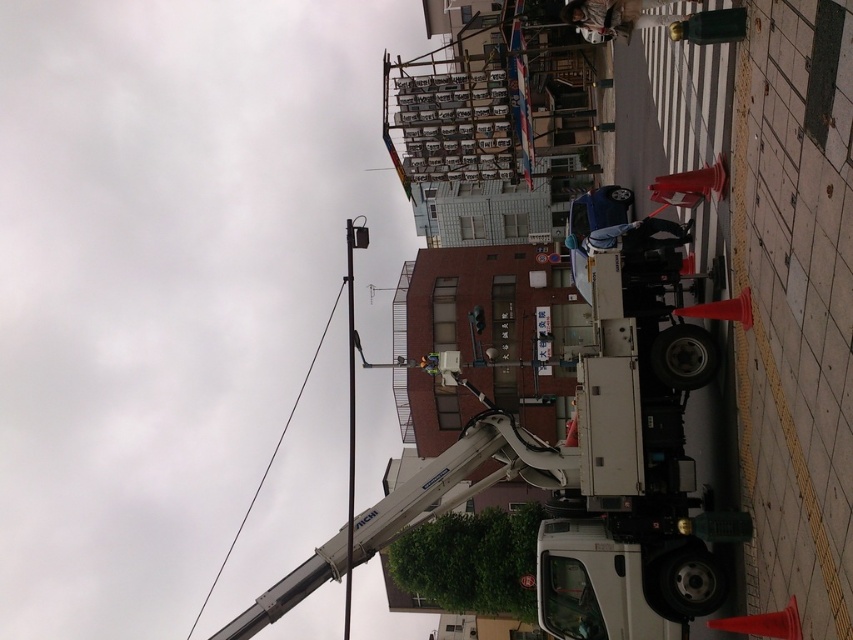
Question: Considering the relative positions of brushed metal pole at upper center and metallic wire at upper center in the image provided, where is brushed metal pole at upper center located with respect to metallic wire at upper center?

Choices:
 (A) above
 (B) below

Answer: (A)

Question: Can you confirm if brushed metal pole at upper center is positioned to the right of metallic wire at upper center?

Choices:
 (A) no
 (B) yes

Answer: (B)

Question: Does brushed metal pole at upper center have a lesser width compared to metallic wire at upper center?

Choices:
 (A) yes
 (B) no

Answer: (A)

Question: Which of the following is the farthest from the observer?

Choices:
 (A) metallic wire at upper center
 (B) brushed metal pole at upper center

Answer: (A)